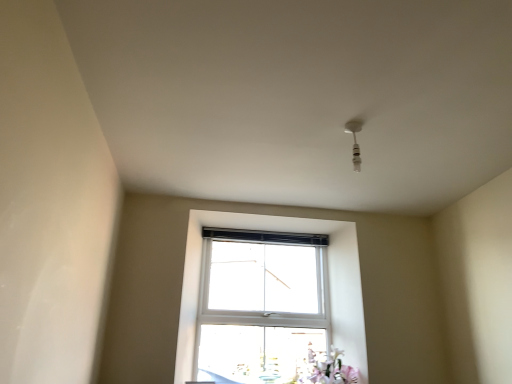
Question: Considering the positions of pink matte flower at lower right and white plastic light fixture at upper center in the image, is pink matte flower at lower right wider or thinner than white plastic light fixture at upper center?

Choices:
 (A) thin
 (B) wide

Answer: (B)

Question: Is pink matte flower at lower right to the left or to the right of white plastic light fixture at upper center in the image?

Choices:
 (A) left
 (B) right

Answer: (A)

Question: In the image, is pink matte flower at lower right positioned in front of or behind white plastic light fixture at upper center?

Choices:
 (A) front
 (B) behind

Answer: (B)

Question: Which is correct: white plastic light fixture at upper center is inside pink matte flower at lower right, or outside of it?

Choices:
 (A) outside
 (B) inside

Answer: (A)

Question: From their relative heights in the image, would you say white plastic light fixture at upper center is taller or shorter than pink matte flower at lower right?

Choices:
 (A) short
 (B) tall

Answer: (A)

Question: Considering the positions of white plastic light fixture at upper center and pink matte flower at lower right in the image, is white plastic light fixture at upper center wider or thinner than pink matte flower at lower right?

Choices:
 (A) wide
 (B) thin

Answer: (B)

Question: Is point (354, 135) positioned closer to the camera than point (337, 357)?

Choices:
 (A) closer
 (B) farther

Answer: (A)